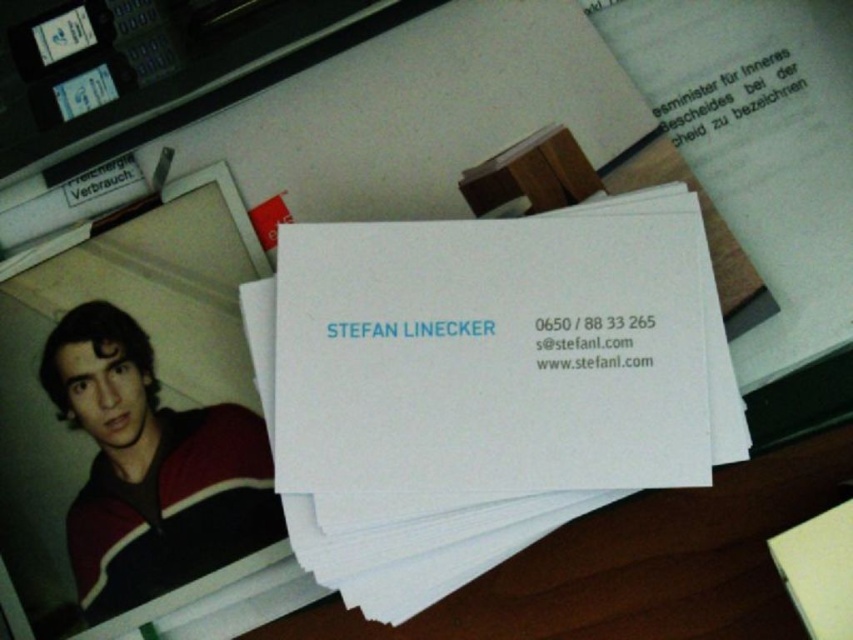
Is white paper at center taller than white matte business card at center?

No, white paper at center is not taller than white matte business card at center.

Is the position of white paper at center more distant than that of white matte business card at center?

That is True.

The width and height of the screenshot is (853, 640). What are the coordinates of `white paper at center` in the screenshot? It's located at (636, 564).

Locate an element on the screen. This screenshot has width=853, height=640. white paper at center is located at coordinates (636, 564).

Can you confirm if striped sweater at lower left is thinner than white matte business card at center?

Indeed, striped sweater at lower left has a lesser width compared to white matte business card at center.

Is striped sweater at lower left smaller than white matte business card at center?

Yes.

Where is `striped sweater at lower left`? striped sweater at lower left is located at coordinates (151, 468).

Is white paper at center thinner than striped sweater at lower left?

No.

Does point (659, 490) lie in front of point (160, 554)?

Yes, point (659, 490) is in front of point (160, 554).

The image size is (853, 640). I want to click on white paper at center, so click(x=636, y=564).

The image size is (853, 640). In order to click on white paper at center in this screenshot , I will do `click(636, 564)`.